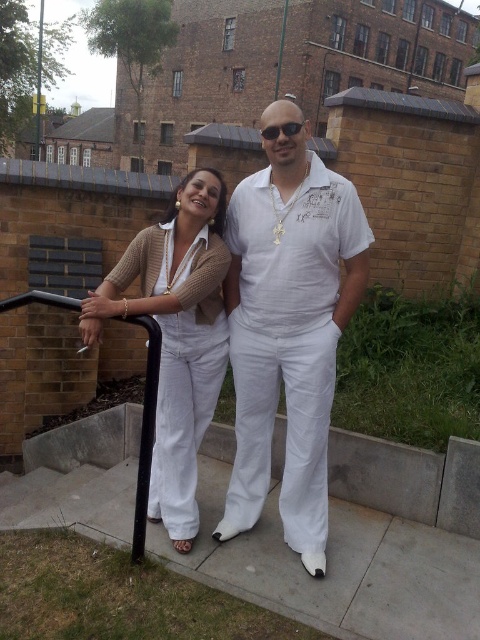
Question: Can you confirm if white matte shirt at center is positioned to the right of black plastic sunglasses at center?

Choices:
 (A) yes
 (B) no

Answer: (A)

Question: Which object appears closest to the camera in this image?

Choices:
 (A) matte white jumpsuit at center
 (B) black metal/rail at left

Answer: (B)

Question: Which of the following is the closest to the observer?

Choices:
 (A) black plastic sunglasses at center
 (B) white matte shirt at center

Answer: (A)

Question: Based on their relative distances, which object is nearer to the white matte shirt at center?

Choices:
 (A) black plastic sunglasses at center
 (B) black metal/rail at left

Answer: (B)

Question: Is matte white jumpsuit at center thinner than black plastic sunglasses at center?

Choices:
 (A) yes
 (B) no

Answer: (B)

Question: Is matte white jumpsuit at center closer to camera compared to black plastic sunglasses at center?

Choices:
 (A) no
 (B) yes

Answer: (B)